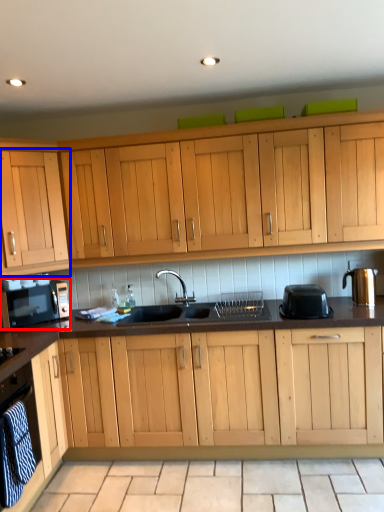
Question: Among these objects, which one is farthest to the camera, home appliance (highlighted by a red box) or cabinetry (highlighted by a blue box)?

Choices:
 (A) home appliance
 (B) cabinetry

Answer: (A)